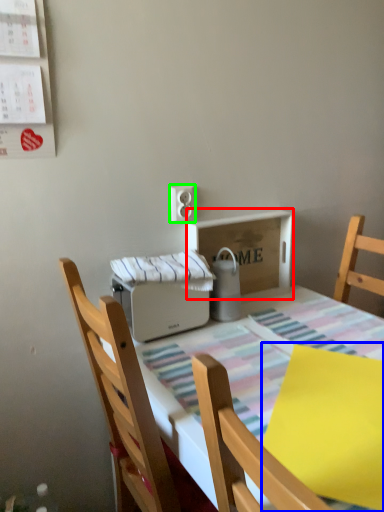
Question: Which object is the closest to the cardboard box (highlighted by a red box)? Choose among these: sheet (highlighted by a blue box) or electric outlet (highlighted by a green box).

Choices:
 (A) sheet
 (B) electric outlet

Answer: (B)